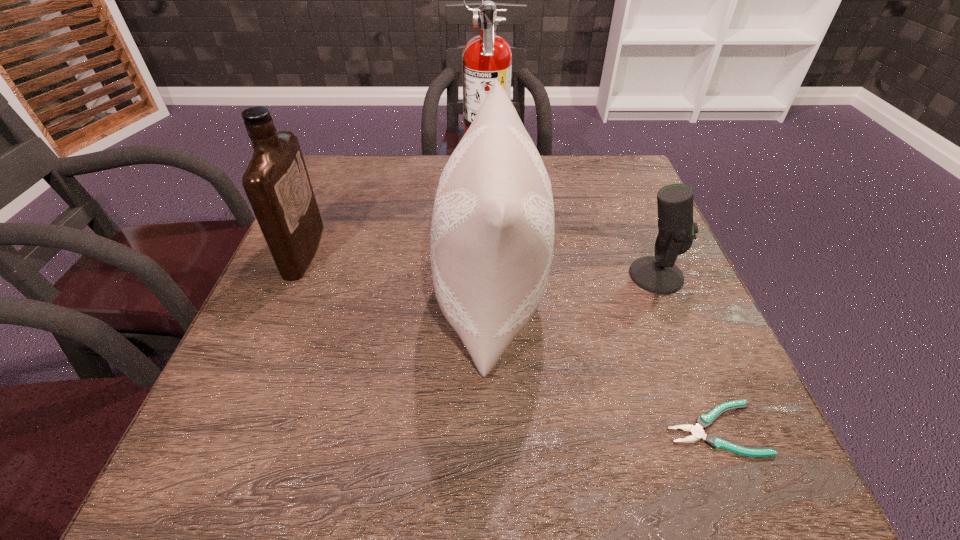
Find the location of a particular element. pliers located in the right edge section of the desktop is located at coordinates (704, 421).

The image size is (960, 540). I want to click on object located in the near right corner section of the desktop, so click(704, 421).

Where is `vacant space at the far edge`? The height and width of the screenshot is (540, 960). vacant space at the far edge is located at coordinates (566, 171).

Identify the location of vacant space at the near edge. (623, 478).

In the image, there is a desktop. Where is `free space at the left edge`? The width and height of the screenshot is (960, 540). free space at the left edge is located at coordinates (314, 267).

This screenshot has height=540, width=960. Find the location of `free location at the right edge`. free location at the right edge is located at coordinates (739, 396).

This screenshot has height=540, width=960. I want to click on blank space at the far left corner of the desktop, so pyautogui.click(x=379, y=163).

I want to click on free location at the far right corner of the desktop, so click(599, 199).

You are a GUI agent. You are given a task and a screenshot of the screen. Output one action in this format:
    pyautogui.click(x=<x>, y=<y>)
    Task: Click on the vacant space at the near right corner of the desktop
    
    Given the screenshot: What is the action you would take?
    pyautogui.click(x=669, y=445)

Where is `free point between the leftmost object and the farthest object`? free point between the leftmost object and the farthest object is located at coordinates 396,213.